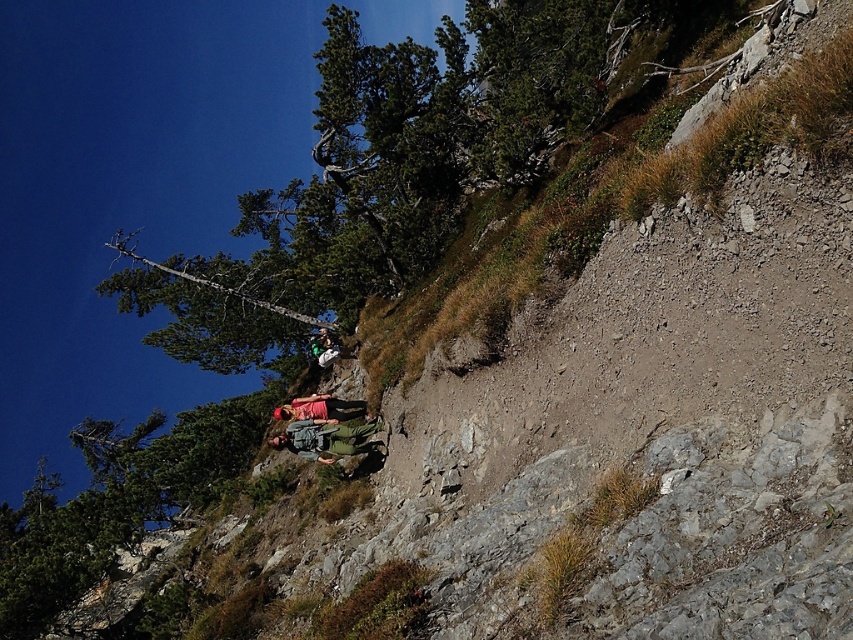
You are a hiker trying to navigate the rugged terrain. You see a matte pink shirt at center and a green fabric backpack at center. How far apart are these two items?

The matte pink shirt at center and green fabric backpack at center are 6.91 meters apart.

You are a hiker on the dirt path and want to take a photo of the matte pink shirt at center and the green fabric backpack at center. Which object should you focus on first if you want to capture both in the frame without moving the camera?

You should focus on the matte pink shirt at center first because it is positioned to the left of the green fabric backpack at center, so capturing it first ensures both are in the frame without needing to adjust the camera angle.